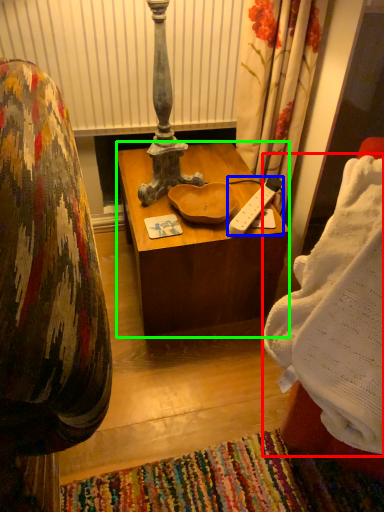
Question: Which object is the farthest from blanket (highlighted by a red box)? Choose among these: remote control (highlighted by a blue box) or desk (highlighted by a green box).

Choices:
 (A) remote control
 (B) desk

Answer: (B)